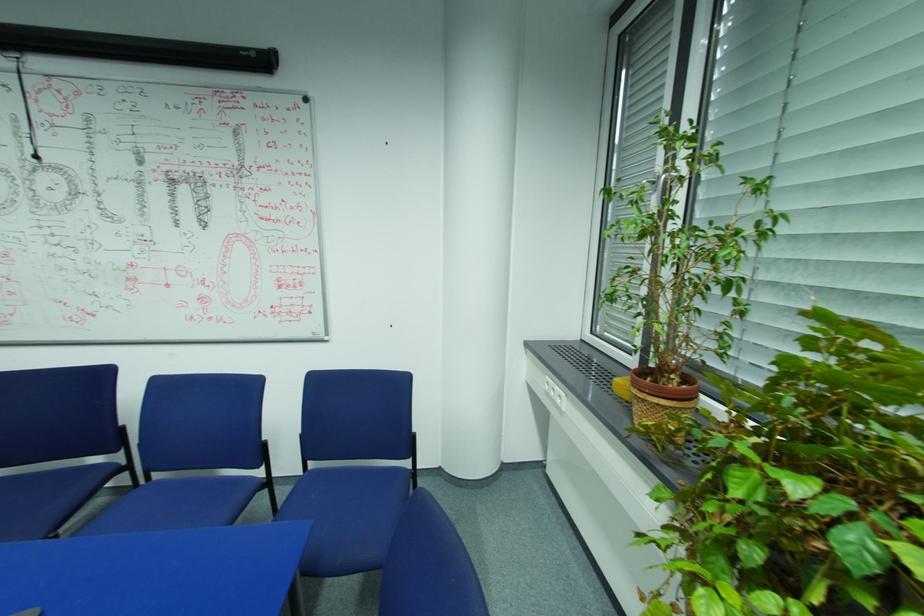
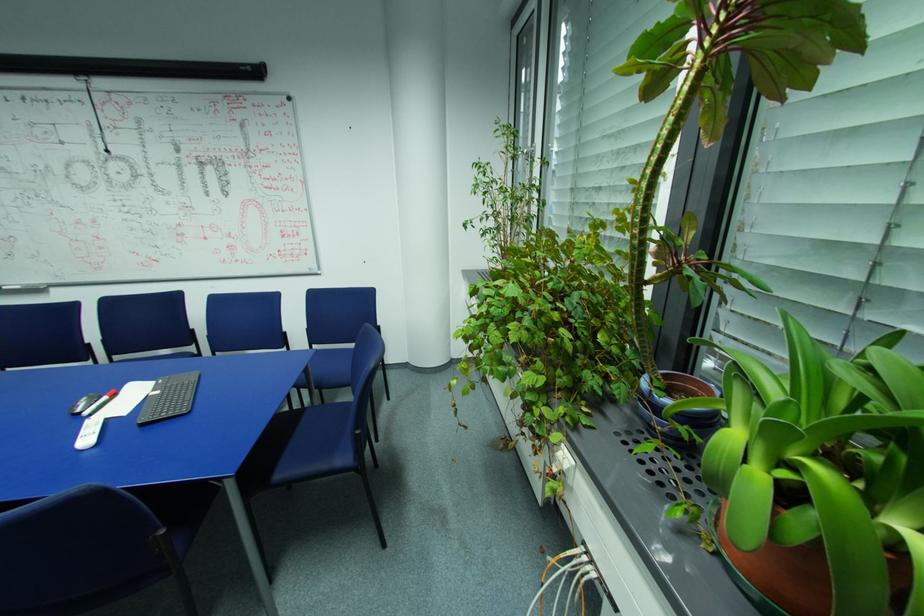
What movement of the cameraman would produce the second image?

The movement direction of the cameraman is right, backward.